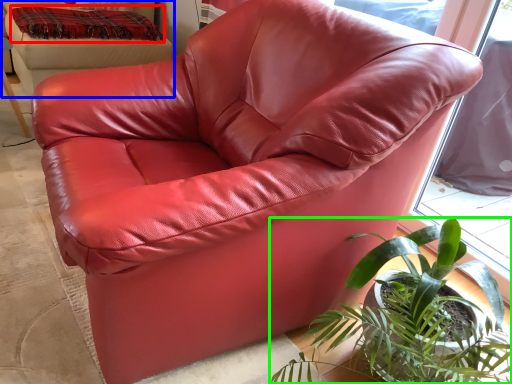
Question: Estimate the real-world distances between objects in this image. Which object is farther from blanket (highlighted by a red box), bean bag chair (highlighted by a blue box) or houseplant (highlighted by a green box)?

Choices:
 (A) bean bag chair
 (B) houseplant

Answer: (B)